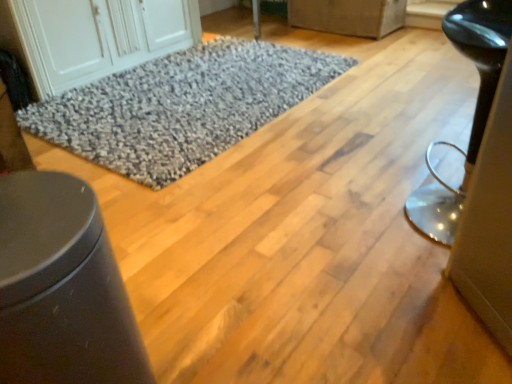
This screenshot has width=512, height=384. I want to click on vacant space situated on the left part of glossy black stool at right, which is counted as the second furniture, starting from the left, so click(347, 226).